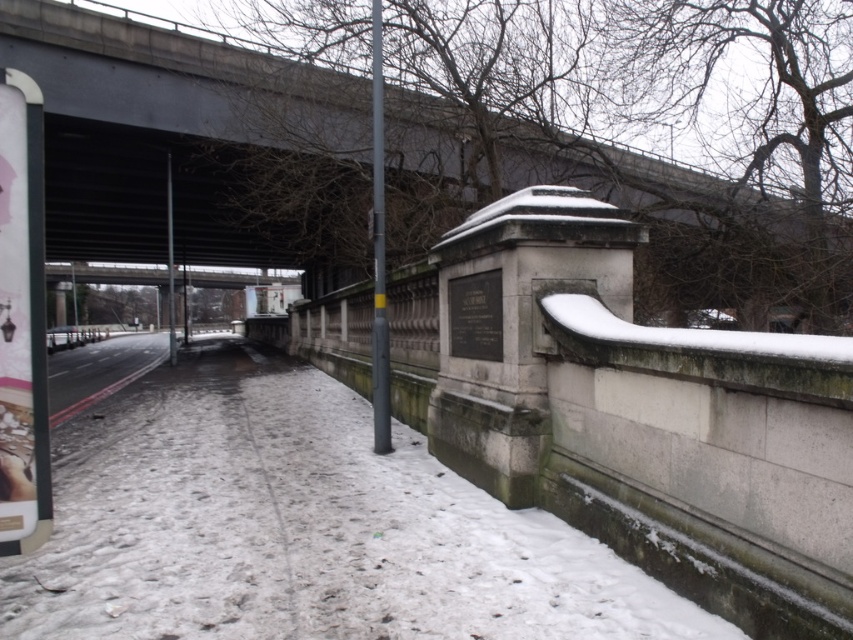
You are a delivery person trying to navigate through the winter scene under the bridge. You need to deliver a package to the gray stone monument at center. Given the concrete bridge at upper center is above it, how should you approach the monument without going under the bridge?

The concrete bridge at upper center is positioned over the gray stone monument at center, so you should approach the monument from the sides or around the bridge structure to avoid going under the bridge.